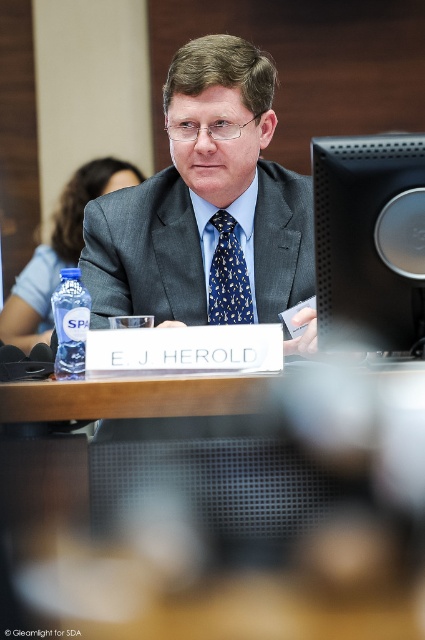
Question: Among these points, which one is farthest from the camera?

Choices:
 (A) (283, 308)
 (B) (218, 321)
 (C) (334, 326)

Answer: (B)

Question: Is matte gray suit at center bigger than blue printed silk tie at center?

Choices:
 (A) yes
 (B) no

Answer: (A)

Question: Which object is farther from the camera taking this photo?

Choices:
 (A) matte gray suit at center
 (B) blue printed silk tie at center

Answer: (B)

Question: Among these objects, which one is nearest to the camera?

Choices:
 (A) blue printed silk tie at center
 (B) black matte monitor at upper right

Answer: (B)

Question: Does matte gray suit at center appear on the right side of blue printed silk tie at center?

Choices:
 (A) yes
 (B) no

Answer: (B)

Question: Can you confirm if black matte monitor at upper right is wider than blue printed silk tie at center?

Choices:
 (A) yes
 (B) no

Answer: (A)